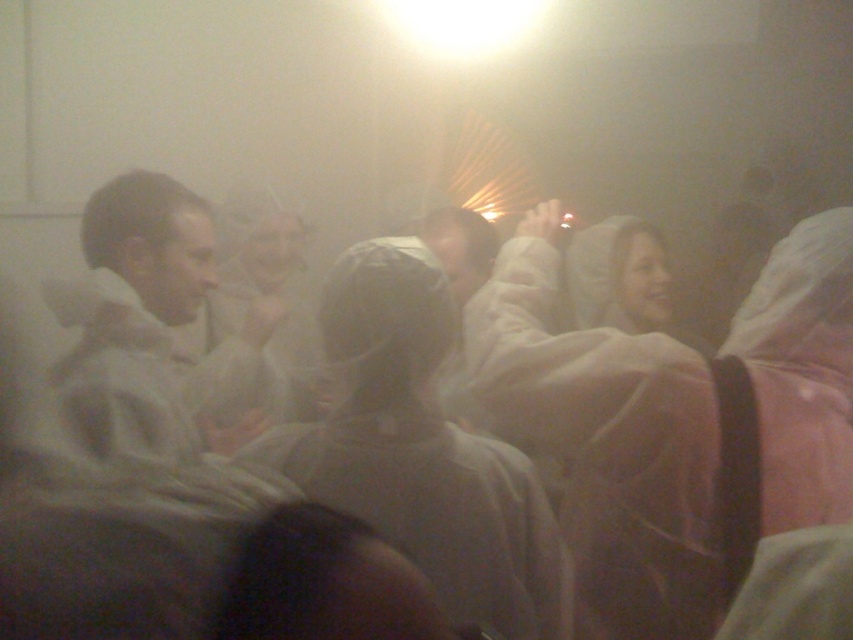
You are a photographer trying to capture a clear shot of the white plastic bag at center and the white matte jacket at center in this dimly lit scene. Since the lighting is very low, you want to adjust your camera settings to focus on both objects. However, you can only focus on one object clearly at a time. Which object should you choose to focus on if you want the other to remain somewhat in focus?

The white plastic bag at center is below the white matte jacket at center, so focusing on the white matte jacket at center would keep the white plastic bag at center within a closer focal plane, making it somewhat in focus.

You are a person standing in the theater and you want to pick up the white plastic bag at center and the smooth white coat at center. Which one should you reach for first based on their positions?

The white plastic bag at center is below the smooth white coat at center, so you should reach for the smooth white coat at center first before picking up the white plastic bag at center.

Based on the photo, you are standing in a dimly lit theater and see two points marked in the scene. The first point is at coordinates point (433, 557) and the second is at point (625, 241). Which point is closer to you?

Point (433, 557) is closer to the viewer than point (625, 241).